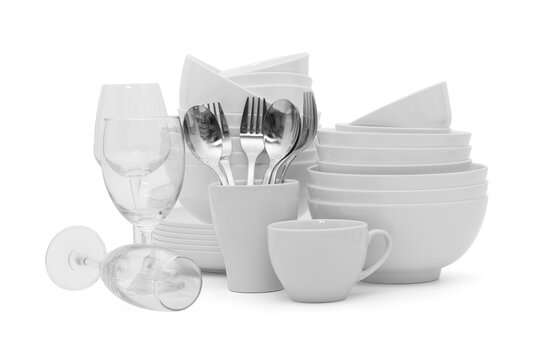
I want to click on plates, so click(186, 225), click(178, 229), click(194, 237), click(184, 241), click(195, 246), click(202, 257).